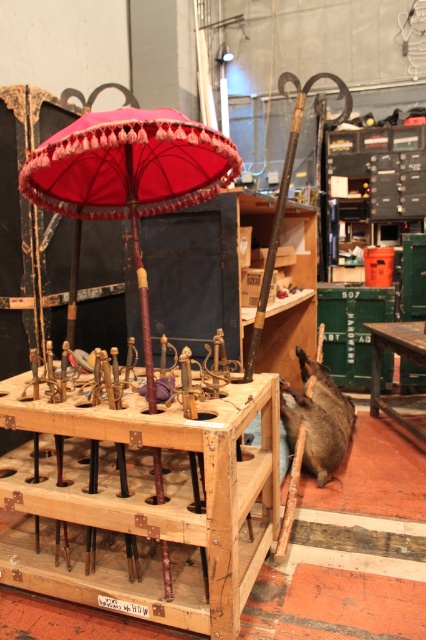
You are standing in the workshop and want to pick up an item located at point [160,420] and another item at point [51,164]. Which item will you reach first if you move towards them one at a time?

You will reach the item at point [160,420] first because it is closer to you than the item at point [51,164].

You are organizing items in a workshop and need to place the wooden at center and the velvet pink parasol at center into a storage box. The box can only accommodate items up to the size of the larger object. Which object should you use to determine the minimum required size for the storage box?

The velvet pink parasol at center is larger than the wooden at center, so the storage box must be at least as large as the velvet pink parasol at center to accommodate both items.

You are a photographer setting up a shot in the workshop. You want to focus on the velvet pink parasol at center while keeping the wooden at center in the background. Is the current arrangement suitable for this setup?

The wooden at center is closer to the viewer than the velvet pink parasol at center, so the velvet pink parasol at center would actually be in the background if the wooden at center is in the foreground. To achieve the desired focus on the velvet pink parasol at center with the wooden at center in the background, you would need to adjust their positions or the camera angle so that the velvet pink parasol at center is closer to the camera than the wooden at center.